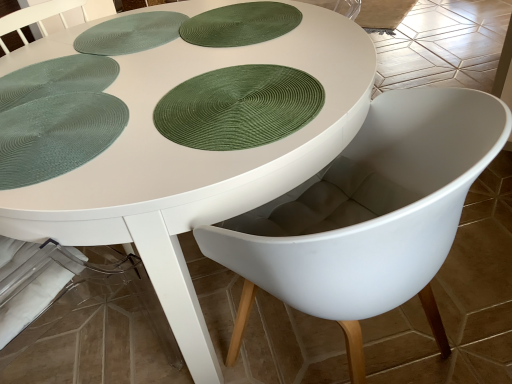
Identify the location of vacant area that lies to the right of green textured placemat at left, marked as the fourth paper plate in a top-to-bottom arrangement. (192, 118).